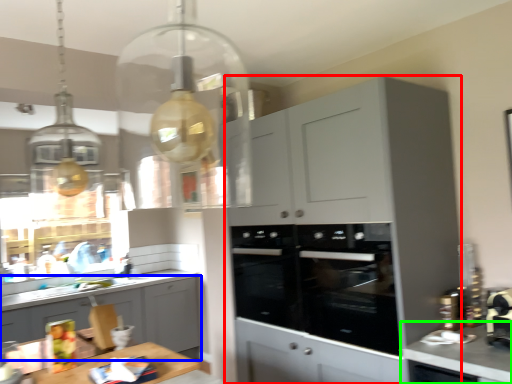
Question: Considering the real-world distances, which object is farthest from cabinetry (highlighted by a red box)? cabinetry (highlighted by a blue box) or countertop (highlighted by a green box)?

Choices:
 (A) cabinetry
 (B) countertop

Answer: (A)